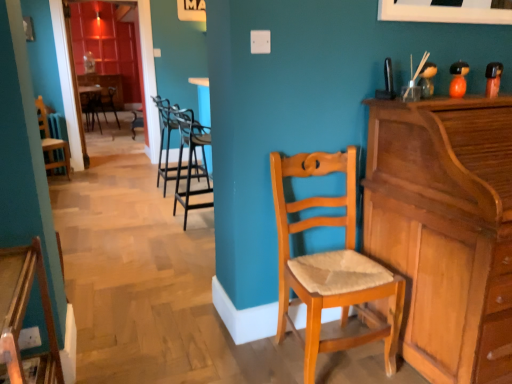
Question: From the image's perspective, relative to black metal barstools at center, marked as the 2th chair in a right-to-left arrangement, is light brown wood piano at right above or below?

Choices:
 (A) below
 (B) above

Answer: (A)

Question: Considering the positions of light brown wood piano at right and black metal barstools at center, marked as the 2th chair in a right-to-left arrangement, in the image, is light brown wood piano at right wider or thinner than black metal barstools at center, marked as the 2th chair in a right-to-left arrangement,?

Choices:
 (A) wide
 (B) thin

Answer: (A)

Question: Which is farther from the wooden chair at left, the second chair when ordered from back to front?

Choices:
 (A) wooden chair with cushion at lower left, the sixth chair from the back
 (B) light brown wood piano at right
 (C) black metal barstools at center, which appears as the fourth chair when viewed from the back
 (D) light brown wooden chair at center, which is the second chair in front-to-back order
 (E) wooden chair with cushion at center, which is counted as the 1th chair, starting from the back

Answer: (B)

Question: Which object is positioned farthest from the light brown wooden chair at center, the fifth chair positioned from the back?

Choices:
 (A) wooden chair at left, which is counted as the 5th chair, starting from the front
 (B) black metal barstools at center, the fourth chair viewed from the front
 (C) wooden chair with cushion at center, which ranks as the 1th chair in left-to-right order
 (D) light brown wood piano at right
 (E) wooden chair with cushion at lower left, positioned as the fourth chair in left-to-right order

Answer: (C)